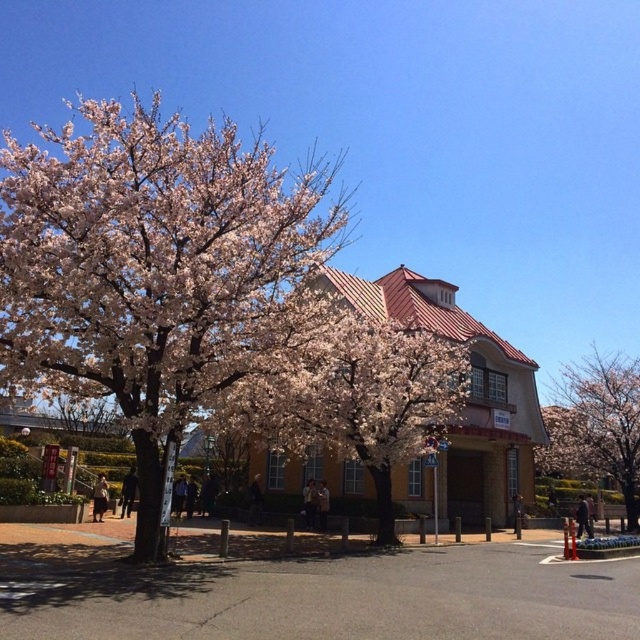
Find the location of a particular element. The height and width of the screenshot is (640, 640). peachy-pink blossoms at upper left is located at coordinates (160, 262).

Which is behind, point (147, 145) or point (604, 356)?

The point (604, 356) is behind.

You are a GUI agent. You are given a task and a screenshot of the screen. Output one action in this format:
    pyautogui.click(x=<x>, y=<y>)
    Task: Click on the peachy-pink blossoms at upper left
    The image size is (640, 640).
    Given the screenshot: What is the action you would take?
    160,262

Where is `peachy-pink blossoms at upper left`? peachy-pink blossoms at upper left is located at coordinates (160, 262).